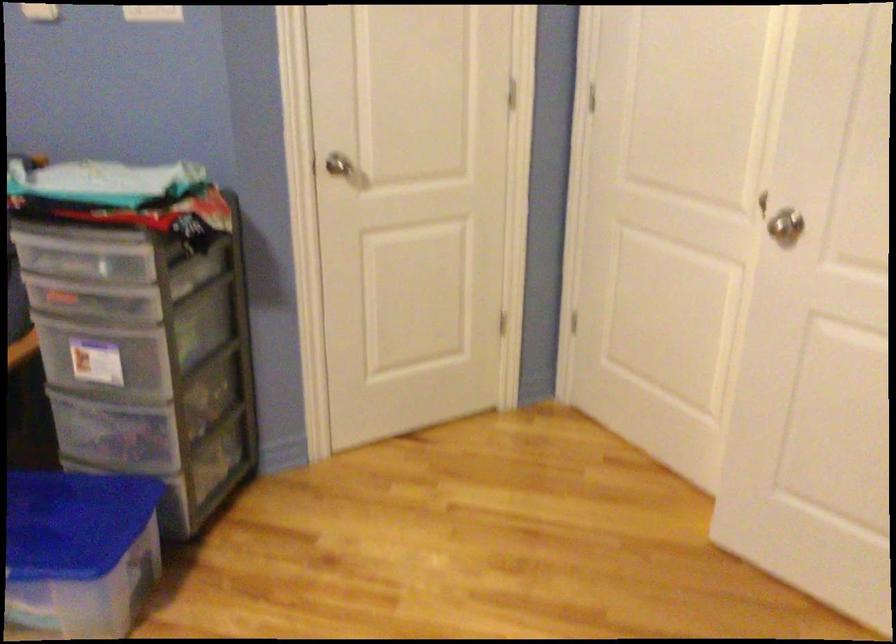
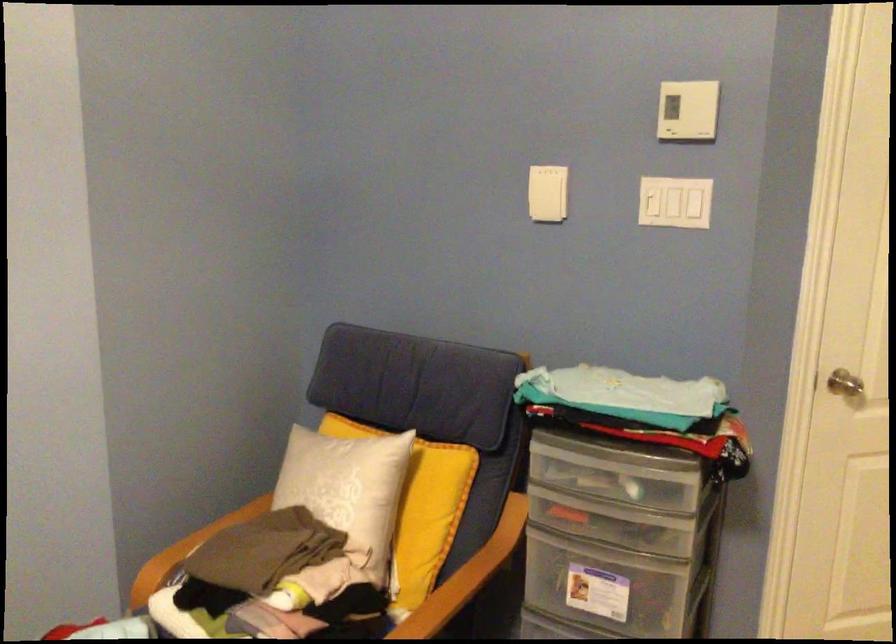
Question: Which direction would the cameraman need to move to produce the second image? Reply with the corresponding letter.

Choices:
 (A) Left
 (B) Right
 (C) Forward
 (D) Backward

Answer: (A)